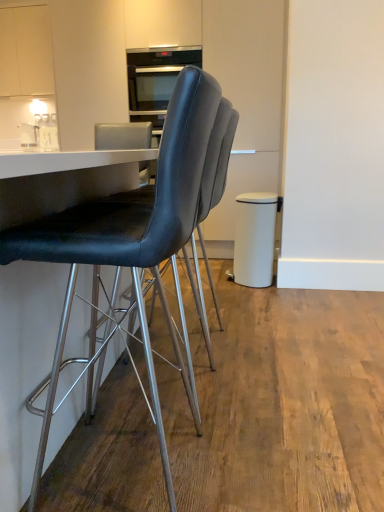
This screenshot has height=512, width=384. What are the coordinates of `free spot to the right of black leather chair at center, placed as the 2th chair when sorted from front to back` in the screenshot? It's located at (280, 391).